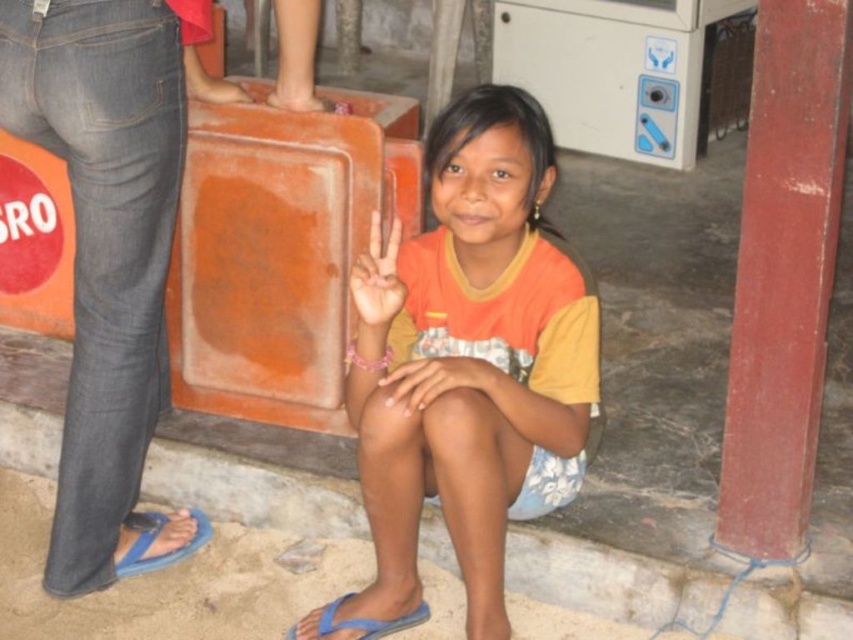
You are a photographer trying to capture the girl making a peace sign. You need to ensure that both the smooth skin hand at center and the blue rubber sandal at lower left are visible in the frame. Given their sizes, which object should you focus on to ensure they are both in the shot?

The smooth skin hand at center is smaller than the blue rubber sandal at lower left. To ensure both are visible, focus on the blue rubber sandal at lower left since it is larger and easier to capture in the frame.

Looking at this image, please describe the location of the orange cotton shirt at center in the image using coordinates. The scene has a young girl sitting on the ground indoors with a bright orange structure behind her and a partially visible person in the background.

The orange cotton shirt at center is located at coordinates point (474, 356).

You are a delivery robot with a width of 1 meter. You need to move from the smooth skin hand at center to the blue rubber sandal at lower left. Can you pass through the space between them without touching either?

The distance between the smooth skin hand at center and the blue rubber sandal at lower left is 1.07 meters, so yes, the robot can pass through the space between them since the distance is slightly larger than the robot width of 1 meter.